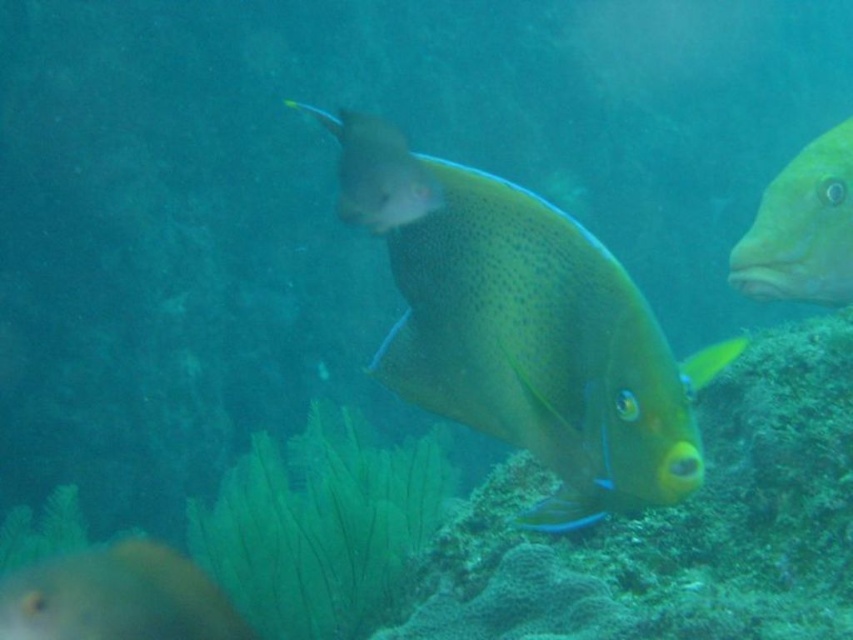
Does translucent yellow fish at center have a lesser height compared to yellow matte fish at right?

Incorrect, translucent yellow fish at center's height does not fall short of yellow matte fish at right's.

Who is more forward, (x=364, y=179) or (x=848, y=186)?

Positioned in front is point (x=364, y=179).

The width and height of the screenshot is (853, 640). In order to click on translucent yellow fish at center in this screenshot , I will do coord(524,328).

Who is higher up, translucent yellow fish at center or shiny yellow fish at center?

translucent yellow fish at center is higher up.

How much distance is there between translucent yellow fish at center and shiny yellow fish at center?

37.29 inches

What do you see at coordinates (524, 328) in the screenshot?
I see `translucent yellow fish at center` at bounding box center [524, 328].

You are a GUI agent. You are given a task and a screenshot of the screen. Output one action in this format:
    pyautogui.click(x=<x>, y=<y>)
    Task: Click on the translucent yellow fish at center
    
    Given the screenshot: What is the action you would take?
    tap(524, 328)

Consider the image. Is shiny yellow fish at center to the right of yellow matte fish at right from the viewer's perspective?

In fact, shiny yellow fish at center is to the left of yellow matte fish at right.

Is shiny yellow fish at center above yellow matte fish at right?

Incorrect, shiny yellow fish at center is not positioned above yellow matte fish at right.

Where is `shiny yellow fish at center`? Image resolution: width=853 pixels, height=640 pixels. shiny yellow fish at center is located at coordinates (117, 596).